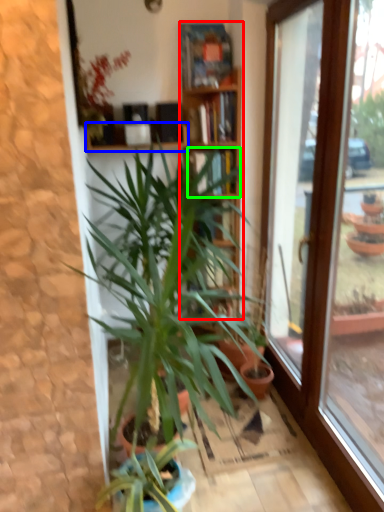
Question: Estimate the real-world distances between objects in this image. Which object is closer to bookcase (highlighted by a red box), shelf (highlighted by a blue box) or shelf (highlighted by a green box)?

Choices:
 (A) shelf
 (B) shelf

Answer: (B)